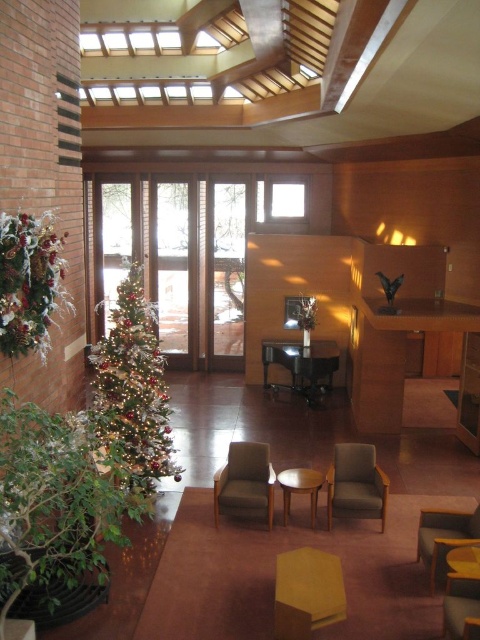
Is iridescent metallic christmas tree at left bigger than light brown wooden table at center?

Correct, iridescent metallic christmas tree at left is larger in size than light brown wooden table at center.

Identify the location of iridescent metallic christmas tree at left. The width and height of the screenshot is (480, 640). (133, 387).

Where is `iridescent metallic christmas tree at left`? This screenshot has height=640, width=480. iridescent metallic christmas tree at left is located at coordinates (133, 387).

Where is `iridescent metallic christmas tree at left`? This screenshot has width=480, height=640. iridescent metallic christmas tree at left is located at coordinates (133, 387).

Is matte brown armchair at center smaller than wooden armchair at lower right?

No, matte brown armchair at center is not smaller than wooden armchair at lower right.

Does matte brown armchair at center appear over wooden armchair at lower right?

Yes, matte brown armchair at center is above wooden armchair at lower right.

Is point (363, 492) behind point (444, 609)?

Yes, point (363, 492) is behind point (444, 609).

At what (x,y) coordinates should I click in order to perform the action: click on matte brown armchair at center. Please return your answer as a coordinate pair (x, y). Looking at the image, I should click on (356, 483).

How far apart are matte yellow armchair at lower right and light brown wooden table at center?

The distance of matte yellow armchair at lower right from light brown wooden table at center is 1.55 meters.

Does matte yellow armchair at lower right appear under light brown wooden table at center?

Correct, matte yellow armchair at lower right is located below light brown wooden table at center.

Is point (467, 540) in front of point (321, 483)?

Yes, point (467, 540) is closer to viewer.

Where is `matte yellow armchair at lower right`? The width and height of the screenshot is (480, 640). matte yellow armchair at lower right is located at coordinates pyautogui.click(x=444, y=538).